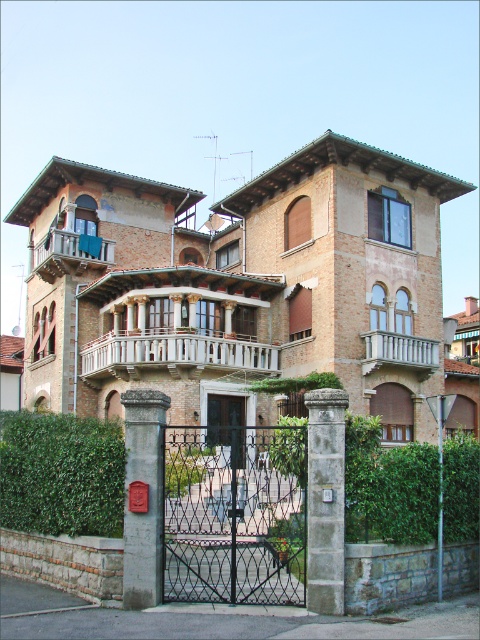
Is smooth concrete post at center below white wooden balcony at center?

Correct, smooth concrete post at center is located below white wooden balcony at center.

Does smooth concrete post at center appear on the right side of white wooden balcony at center?

Indeed, smooth concrete post at center is positioned on the right side of white wooden balcony at center.

The width and height of the screenshot is (480, 640). Find the location of `smooth concrete post at center`. smooth concrete post at center is located at coordinates (143, 497).

Consider the image. Is stone gate post at center thinner than matte black gate at center?

Correct, stone gate post at center's width is less than matte black gate at center's.

Is stone gate post at center to the right of matte black gate at center from the viewer's perspective?

Yes, stone gate post at center is to the right of matte black gate at center.

Identify the location of stone gate post at center. [x=325, y=500].

Which is behind, point (186, 465) or point (37, 272)?

Point (37, 272)

Does black wrought iron gate at center have a larger size compared to wooden balcony at upper left?

Correct, black wrought iron gate at center is larger in size than wooden balcony at upper left.

Does point (215, 534) come in front of point (110, 259)?

Yes, it is in front of point (110, 259).

Identify the location of black wrought iron gate at center. (235, 515).